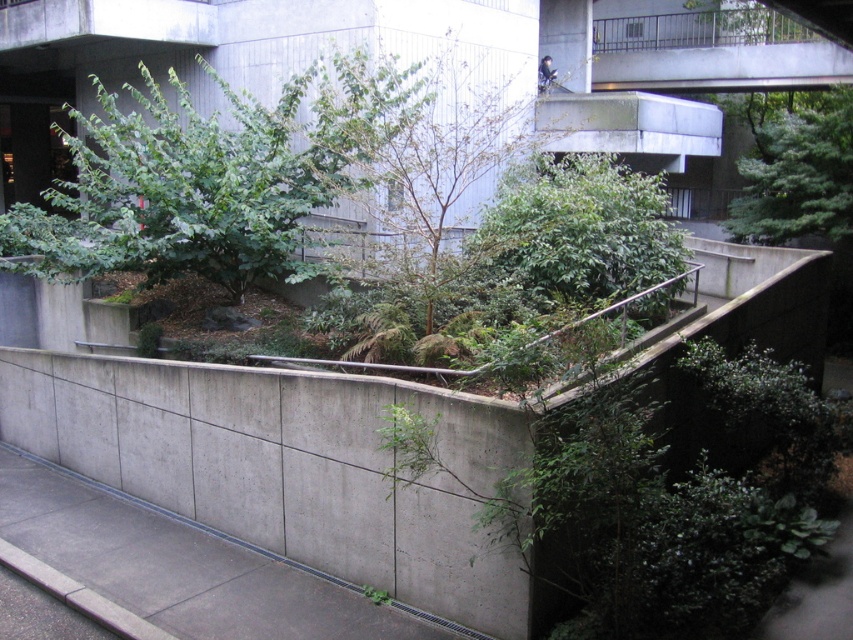
Consider the image. You are standing at the origin point of the coordinate system in the urban landscape. The green leafy tree at center is located at point 0.241, 0.490. If you want to walk directly towards the tree, what direction should you head?

Since the green leafy tree at center is located at coordinates 0.241 on the x and 0.490 on the y axis, you should head northeast to reach it.

You are standing in front of the concrete wall and want to walk towards the green textured tree at upper right. Which direction should you turn to first see the green leafy tree at center?

The green leafy tree at center is to the left of the green textured tree at upper right, so you should turn to your left to see the green leafy tree at center first.

You are standing in front of the concrete wall in the urban landscape. You notice two points marked on the wall at coordinates point [677,340] and point [604,61]. Which point is nearer to your current position?

Point [677,340] is closer to the viewer than point [604,61].